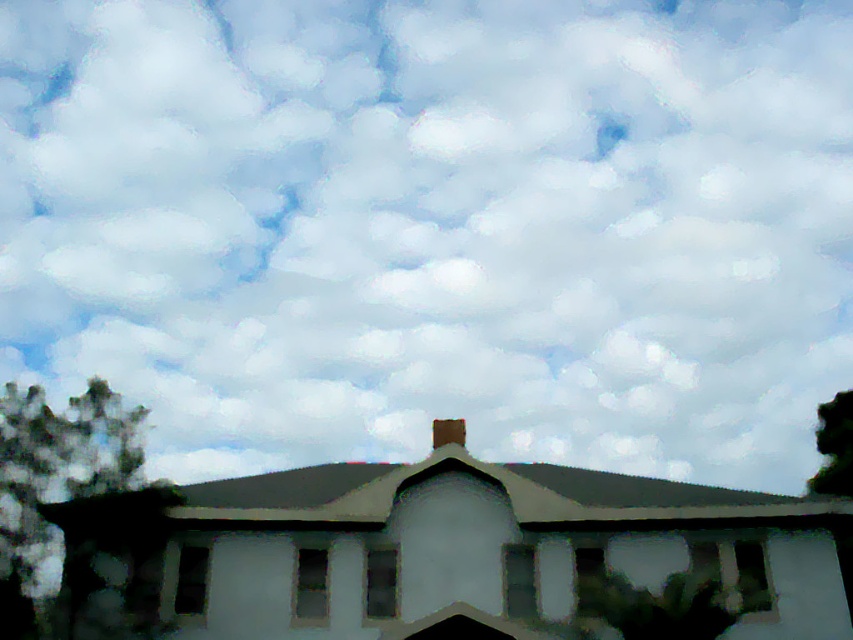
Between green leafy tree at lower left and brown clay chimney at center, which one is positioned higher?

brown clay chimney at center is higher up.

Between green leafy tree at lower left and brown clay chimney at center, which one has more height?

With more height is green leafy tree at lower left.

I want to click on green leafy tree at lower left, so click(55, 483).

I want to click on green leafy tree at lower left, so click(55, 483).

Measure the distance from green matte tree at lower right to brown clay chimney at center.

green matte tree at lower right is 17.52 feet away from brown clay chimney at center.

Which is in front, point (585, 595) or point (437, 433)?

Positioned in front is point (585, 595).

You are a GUI agent. You are given a task and a screenshot of the screen. Output one action in this format:
    pyautogui.click(x=<x>, y=<y>)
    Task: Click on the green matte tree at lower right
    
    Given the screenshot: What is the action you would take?
    pyautogui.click(x=659, y=605)

In order to click on green matte tree at lower right in this screenshot , I will do `click(659, 605)`.

In the scene shown: Which is above, green matte tree at lower right or green leafy tree at lower right?

green matte tree at lower right

Is green matte tree at lower right smaller than green leafy tree at lower right?

Correct, green matte tree at lower right occupies less space than green leafy tree at lower right.

This screenshot has width=853, height=640. Find the location of `green matte tree at lower right`. green matte tree at lower right is located at coordinates (659, 605).